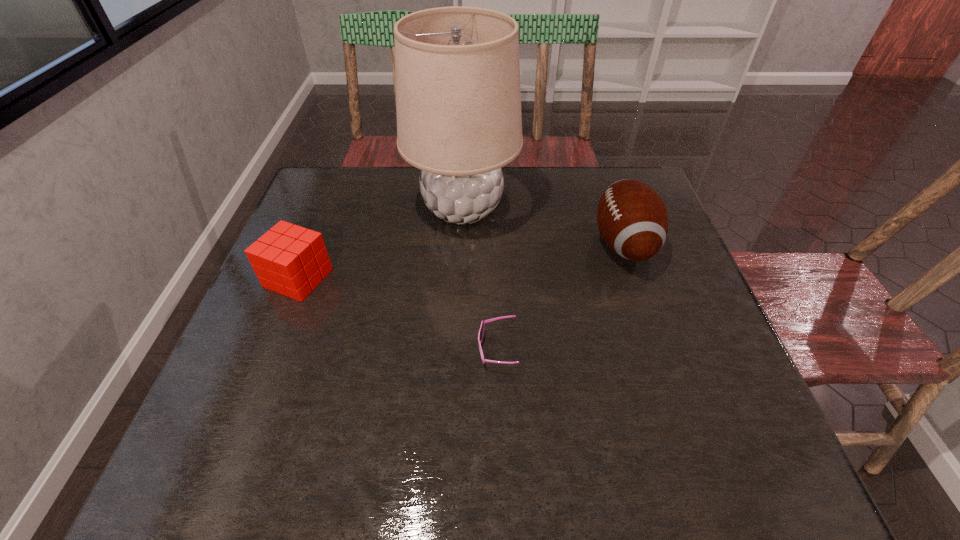
The height and width of the screenshot is (540, 960). Identify the location of vacant space at the far edge of the desktop. point(525,169).

Where is `vacant area at the left edge`? vacant area at the left edge is located at coordinates (304, 322).

You are a GUI agent. You are given a task and a screenshot of the screen. Output one action in this format:
    pyautogui.click(x=<x>, y=<y>)
    Task: Click on the vacant point at the right edge
    The width and height of the screenshot is (960, 540).
    Given the screenshot: What is the action you would take?
    pyautogui.click(x=707, y=331)

The width and height of the screenshot is (960, 540). Find the location of `vacant space at the far left corner`. vacant space at the far left corner is located at coordinates (357, 184).

Find the location of `empty location between the tallest object and the sunglasses`. empty location between the tallest object and the sunglasses is located at coordinates (480, 279).

Where is `vacant area between the cube and the nearest object`? vacant area between the cube and the nearest object is located at coordinates coord(397,314).

This screenshot has width=960, height=540. In order to click on unoccupied position between the cube and the sunglasses in this screenshot , I will do (x=397, y=314).

In order to click on vacant region between the second tallest object and the shortest object in this screenshot , I will do `click(561, 296)`.

Locate an element on the screen. The width and height of the screenshot is (960, 540). free space between the leftmost object and the sunglasses is located at coordinates (397, 314).

In order to click on vacant space in between the third shortest object and the leftmost object in this screenshot , I will do `click(461, 261)`.